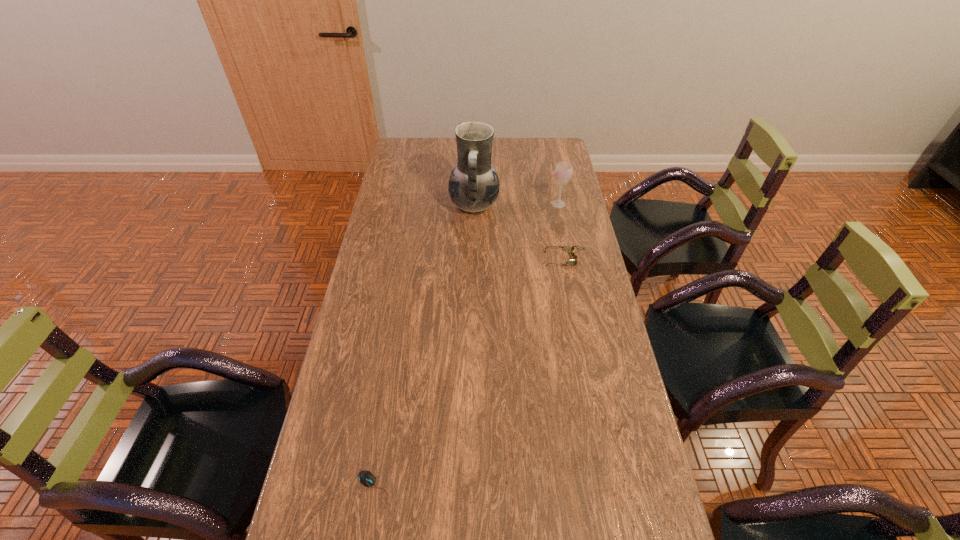
Locate an element on the screen. vacant space that's between the wineglass and the mouse is located at coordinates [x=467, y=346].

You are a GUI agent. You are given a task and a screenshot of the screen. Output one action in this format:
    pyautogui.click(x=<x>, y=<y>)
    Task: Click on the free space that is in between the wineglass and the pitcher
    This screenshot has width=960, height=540.
    Given the screenshot: What is the action you would take?
    pyautogui.click(x=516, y=205)

Where is `vacant space that's between the nearest object and the wineglass`? Image resolution: width=960 pixels, height=540 pixels. vacant space that's between the nearest object and the wineglass is located at coordinates (467, 346).

You are a GUI agent. You are given a task and a screenshot of the screen. Output one action in this format:
    pyautogui.click(x=<x>, y=<y>)
    Task: Click on the blank region between the second shortest object and the tallest object
    The width and height of the screenshot is (960, 540).
    Given the screenshot: What is the action you would take?
    pyautogui.click(x=519, y=233)

At what (x,y) coordinates should I click in order to perform the action: click on free space between the third tallest object and the second tallest object. Please return your answer as a coordinate pair (x, y). The width and height of the screenshot is (960, 540). Looking at the image, I should click on (562, 232).

The image size is (960, 540). In order to click on free spot between the second nearest object and the third object from right to left in this screenshot , I will do `click(519, 233)`.

This screenshot has width=960, height=540. Identify the location of empty space between the leftmost object and the pitcher. (424, 347).

Where is `free space between the second tallest object and the second object from left to right`? The height and width of the screenshot is (540, 960). free space between the second tallest object and the second object from left to right is located at coordinates (516, 205).

Locate an element on the screen. The width and height of the screenshot is (960, 540). blank region between the third object from right to left and the second shortest object is located at coordinates [x=519, y=233].

Locate an element on the screen. The height and width of the screenshot is (540, 960). vacant point located between the second tallest object and the third farthest object is located at coordinates (562, 232).